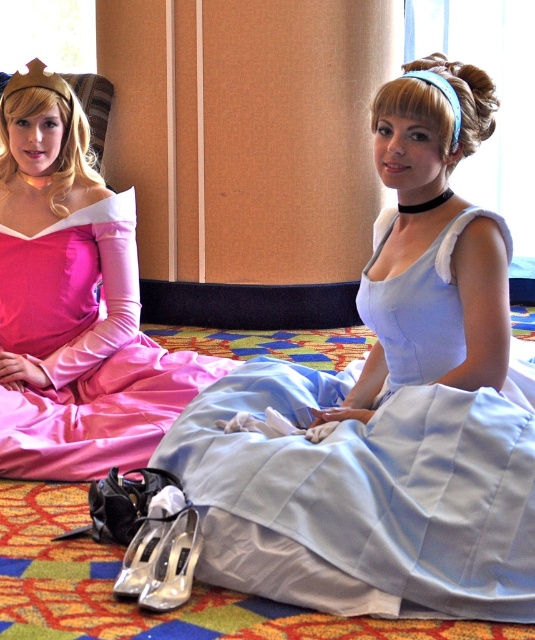
Question: Considering the real-world distances, which object is closest to the satin pink dress at left?

Choices:
 (A) silver metallic shoe at lower center
 (B) light blue satin dress at center

Answer: (B)

Question: Is satin pink dress at left thinner than clear plastic shoe at lower center?

Choices:
 (A) no
 (B) yes

Answer: (A)

Question: Which of the following is the farthest from the observer?

Choices:
 (A) light blue satin dress at center
 (B) silver metallic shoe at lower center
 (C) clear plastic shoe at lower center

Answer: (B)

Question: Does satin pink dress at left appear on the right side of clear plastic shoe at lower center?

Choices:
 (A) no
 (B) yes

Answer: (A)

Question: Can you confirm if light blue satin dress at center is thinner than satin pink dress at left?

Choices:
 (A) no
 (B) yes

Answer: (A)

Question: Which point is farther from the camera taking this photo?

Choices:
 (A) (437, 532)
 (B) (119, 588)
 (C) (111, 241)
 (D) (156, 564)

Answer: (C)